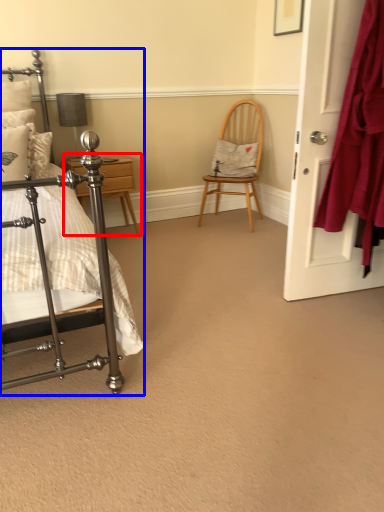
Question: Which object is further to the camera taking this photo, nightstand (highlighted by a red box) or bed (highlighted by a blue box)?

Choices:
 (A) nightstand
 (B) bed

Answer: (A)